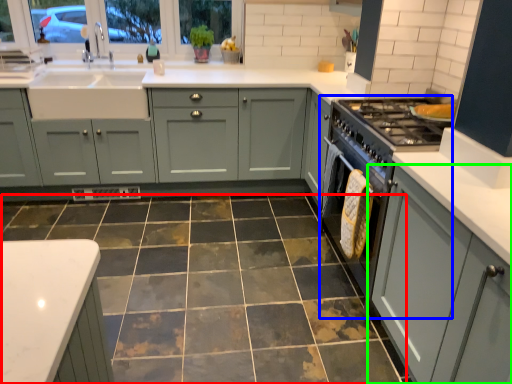
Question: Which object is positioned closest to ceramic tile (highlighted by a red box)? Select from appliance (highlighted by a blue box) and cabinetry (highlighted by a green box).

Choices:
 (A) appliance
 (B) cabinetry

Answer: (A)